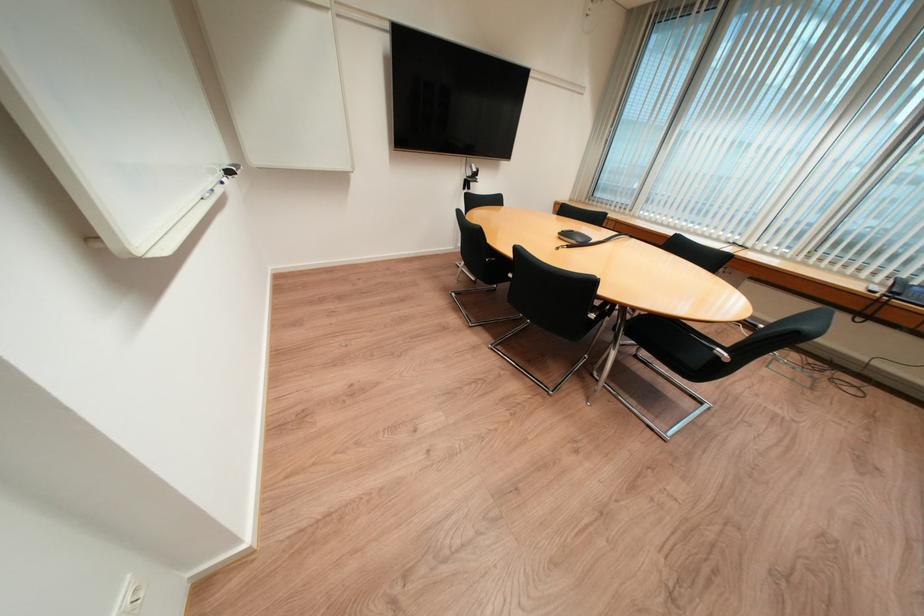
Locate an element on the screen. black chair sitting surface is located at coordinates (671, 339).